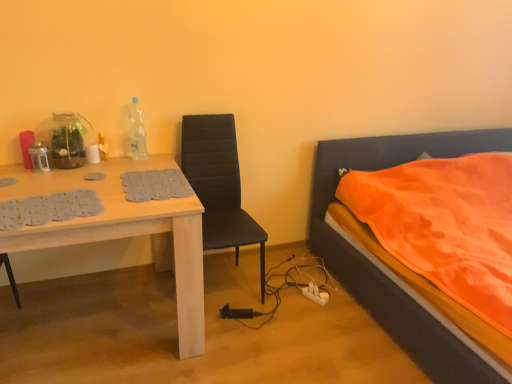
Find the location of a particular element. The height and width of the screenshot is (384, 512). free space to the left of white plastic power outlet at lower center is located at coordinates (289, 299).